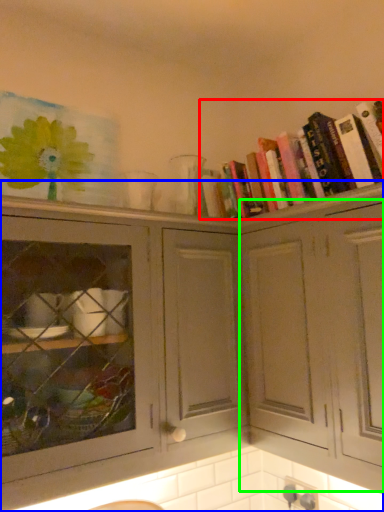
Question: Estimate the real-world distances between objects in this image. Which object is closer to book (highlighted by a red box), cabinetry (highlighted by a blue box) or cabinetry (highlighted by a green box)?

Choices:
 (A) cabinetry
 (B) cabinetry

Answer: (B)